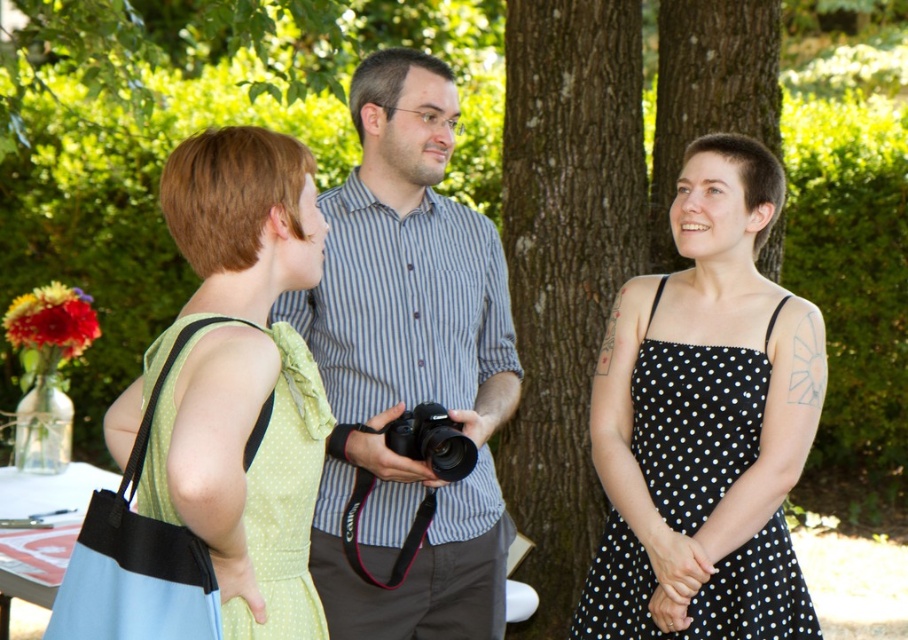
You are planning to take a photo of the brown rough bark tree at center and the black polka dot fabric dress at center. Which object should you focus on first if you want to capture both in one frame without moving the camera?

You should focus on the brown rough bark tree at center first because it is larger than the black polka dot fabric dress at center, so it will require more attention to detail to ensure it fits properly in the frame.

You are planning to take a photo of the striped cotton shirt at center and the green polka dot fabric dress at left. Which one should you focus on first if you want to capture both in the same frame without moving the camera?

The striped cotton shirt at center is taller than the green polka dot fabric dress at left, so you should focus on the striped cotton shirt at center first to ensure both are in frame.

Based on the scene description, where exactly is the striped cotton shirt at center located in terms of coordinates?

The striped cotton shirt at center is located at point (x=408, y=365).